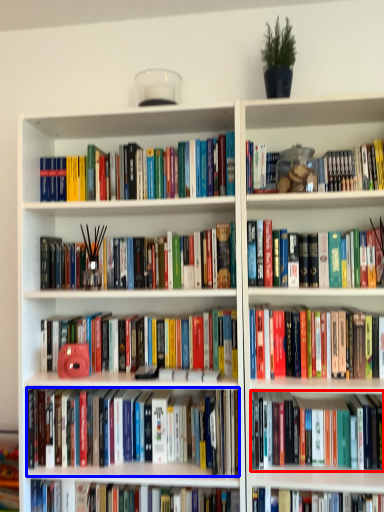
Question: Which object appears closest to the camera in this image, book (highlighted by a red box) or book (highlighted by a blue box)?

Choices:
 (A) book
 (B) book

Answer: (A)